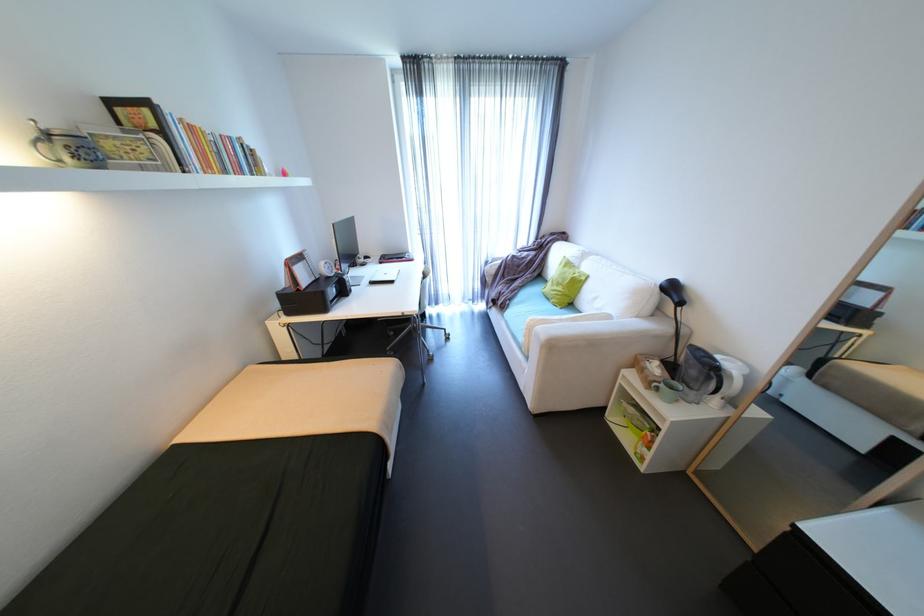
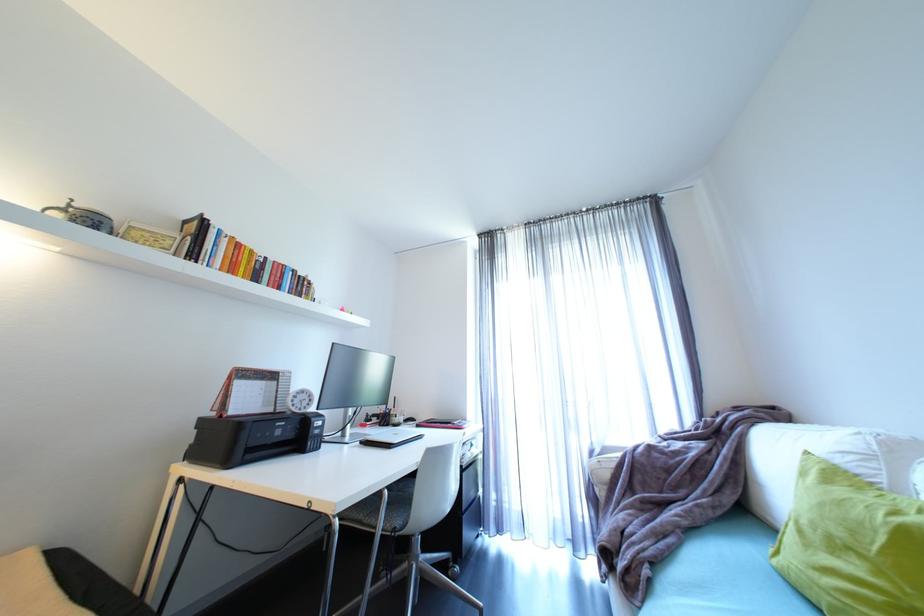
Locate, in the second image, the point that corresponds to (x=306, y=290) in the first image.

(228, 416)